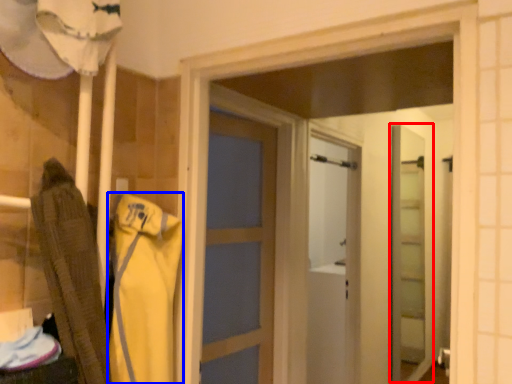
Question: Which of the following is the farthest to the observer, screen door (highlighted by a red box) or clothing (highlighted by a blue box)?

Choices:
 (A) screen door
 (B) clothing

Answer: (A)